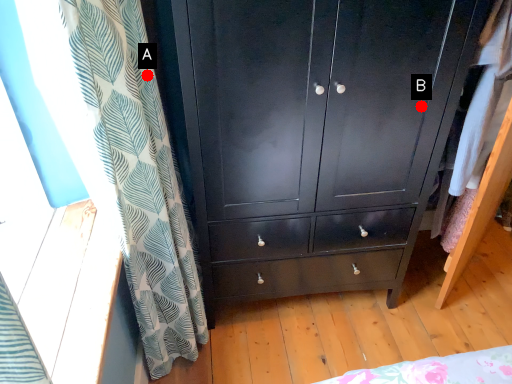
Question: Two points are circled on the image, labeled by A and B beside each circle. Which of the following is the closest to the observer?

Choices:
 (A) A is closer
 (B) B is closer

Answer: (A)